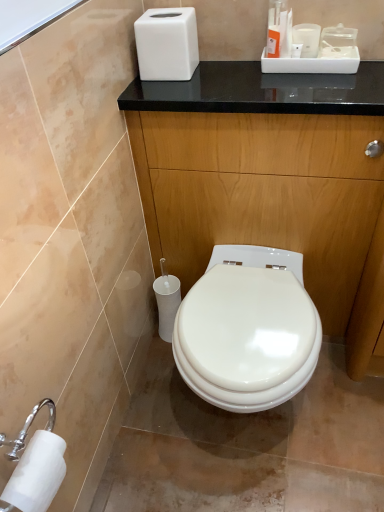
Question: Is white matte toilet paper at lower left, marked as the 1th toilet paper in a bottom-to-top arrangement, wider or thinner than white plastic toilet paper at lower left, which appears as the first toilet paper when viewed from the back?

Choices:
 (A) wide
 (B) thin

Answer: (B)

Question: Is point (56, 437) closer or farther from the camera than point (178, 304)?

Choices:
 (A) closer
 (B) farther

Answer: (A)

Question: Which object is the farthest from the white glossy toilet at center?

Choices:
 (A) white matte tissue box at upper center
 (B) glossy wood dresser at center
 (C) white matte toilet paper at lower left, marked as the 1th toilet paper in a bottom-to-top arrangement
 (D) white plastic toilet paper at lower left, which appears as the first toilet paper when viewed from the back

Answer: (A)

Question: Which is farther from the white glossy toilet at center?

Choices:
 (A) white plastic toilet paper at lower left, which appears as the first toilet paper when viewed from the back
 (B) glossy wood dresser at center
 (C) white matte toilet paper at lower left, marked as the second toilet paper in a top-to-bottom arrangement
 (D) white matte tissue box at upper center

Answer: (D)